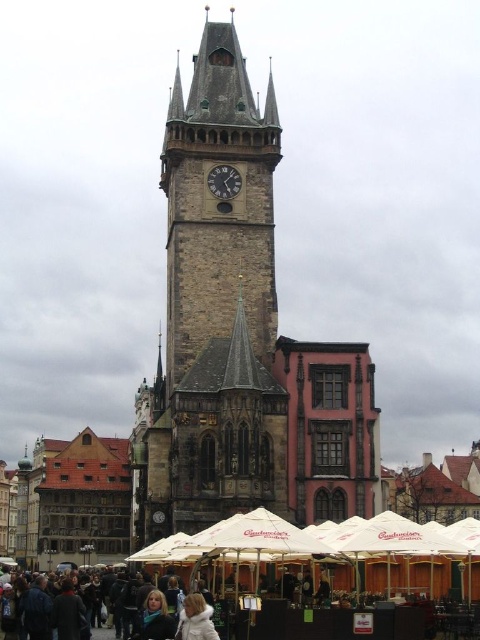
Question: Does stone clock tower at center have a smaller size compared to white fuzzy coat at center?

Choices:
 (A) no
 (B) yes

Answer: (A)

Question: Which point is closer to the camera?

Choices:
 (A) white fuzzy coat at center
 (B) stone clock tower at center
 (C) dark gray stone clock at center

Answer: (A)

Question: Which is farther from the stone clock tower at center?

Choices:
 (A) white fuzzy coat at center
 (B) dark gray stone clock at center

Answer: (A)

Question: Does stone clock tower at center have a greater width compared to white fuzzy coat at center?

Choices:
 (A) no
 (B) yes

Answer: (B)

Question: Does stone clock tower at center have a greater width compared to dark gray stone clock at center?

Choices:
 (A) no
 (B) yes

Answer: (B)

Question: Which is nearer to the stone clock tower at center?

Choices:
 (A) dark gray stone clock at center
 (B) white fuzzy coat at center

Answer: (A)